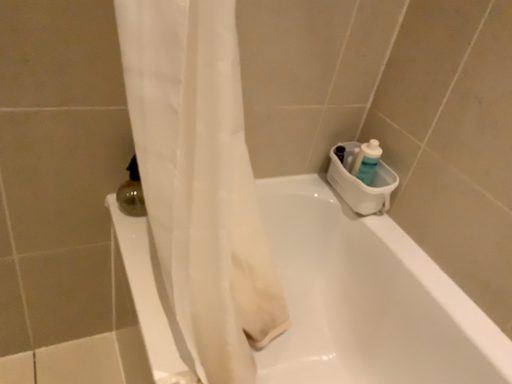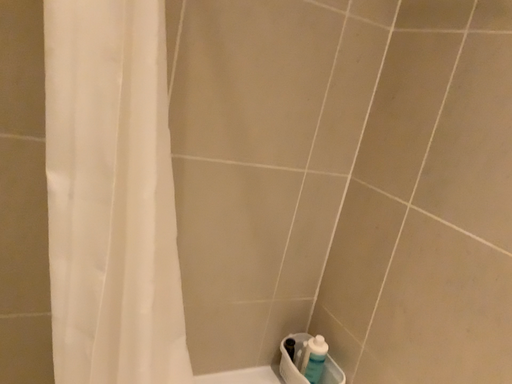
Question: How did the camera likely rotate when shooting the video?

Choices:
 (A) rotated downward
 (B) rotated upward

Answer: (B)